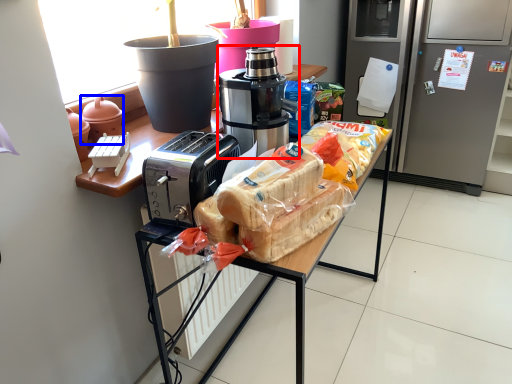
Question: Which point is further to the camera, coffee maker (highlighted by a red box) or appliance (highlighted by a blue box)?

Choices:
 (A) coffee maker
 (B) appliance

Answer: (B)